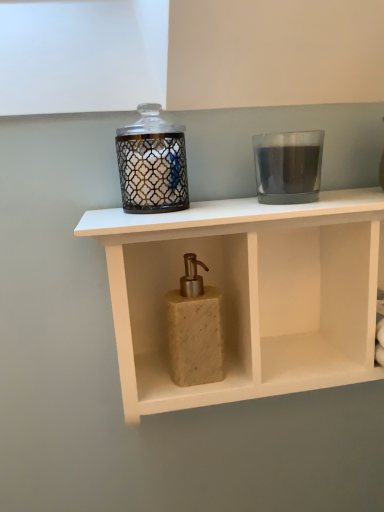
At what (x,y) coordinates should I click in order to perform the action: click on vacant area that is situated to the right of matte glass candle holder at upper center, which is counted as the 2th candle holder, starting from the right. Please return your answer as a coordinate pair (x, y). This screenshot has width=384, height=512. Looking at the image, I should click on (241, 207).